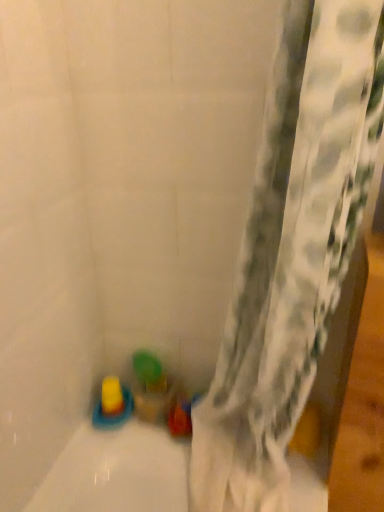
Question: Considering the relative sizes of translucent plastic cup at lower center, the third toy from the left, and yellow rubber toy at lower left, arranged as the first toy when viewed from the left, in the image provided, is translucent plastic cup at lower center, the third toy from the left, thinner than yellow rubber toy at lower left, arranged as the first toy when viewed from the left,?

Choices:
 (A) no
 (B) yes

Answer: (B)

Question: Is yellow rubber toy at lower left, arranged as the first toy when viewed from the left, inside translucent plastic cup at lower center, positioned as the first toy in right-to-left order?

Choices:
 (A) no
 (B) yes

Answer: (A)

Question: Can you confirm if translucent plastic cup at lower center, the third toy from the left, is bigger than yellow rubber toy at lower left, arranged as the first toy when viewed from the left?

Choices:
 (A) yes
 (B) no

Answer: (A)

Question: From a real-world perspective, is translucent plastic cup at lower center, the third toy from the left, on yellow rubber toy at lower left, marked as the 3th toy in a right-to-left arrangement?

Choices:
 (A) yes
 (B) no

Answer: (B)

Question: Does translucent plastic cup at lower center, positioned as the first toy in right-to-left order, turn towards yellow rubber toy at lower left, marked as the 3th toy in a right-to-left arrangement?

Choices:
 (A) yes
 (B) no

Answer: (B)

Question: Can you confirm if translucent plastic cup at lower center, the third toy from the left, is smaller than yellow rubber toy at lower left, arranged as the first toy when viewed from the left?

Choices:
 (A) no
 (B) yes

Answer: (A)

Question: Are translucent yellow toy at bottom left, the 2th toy when ordered from right to left, and yellow rubber toy at lower left, marked as the 3th toy in a right-to-left arrangement, located far from each other?

Choices:
 (A) yes
 (B) no

Answer: (B)

Question: From a real-world perspective, is translucent yellow toy at bottom left, which is counted as the second toy, starting from the left, beneath yellow rubber toy at lower left, marked as the 3th toy in a right-to-left arrangement?

Choices:
 (A) no
 (B) yes

Answer: (B)

Question: Is translucent yellow toy at bottom left, which is counted as the second toy, starting from the left, oriented away from yellow rubber toy at lower left, arranged as the first toy when viewed from the left?

Choices:
 (A) no
 (B) yes

Answer: (A)

Question: Is translucent yellow toy at bottom left, the 2th toy when ordered from right to left, outside yellow rubber toy at lower left, marked as the 3th toy in a right-to-left arrangement?

Choices:
 (A) yes
 (B) no

Answer: (A)

Question: Can you confirm if translucent yellow toy at bottom left, which is counted as the second toy, starting from the left, is positioned to the right of yellow rubber toy at lower left, marked as the 3th toy in a right-to-left arrangement?

Choices:
 (A) no
 (B) yes

Answer: (B)

Question: Considering the relative sizes of translucent yellow toy at bottom left, the 2th toy when ordered from right to left, and yellow rubber toy at lower left, arranged as the first toy when viewed from the left, in the image provided, is translucent yellow toy at bottom left, the 2th toy when ordered from right to left, shorter than yellow rubber toy at lower left, arranged as the first toy when viewed from the left,?

Choices:
 (A) no
 (B) yes

Answer: (B)

Question: Considering the relative positions of yellow rubber toy at lower left, arranged as the first toy when viewed from the left, and translucent plastic cup at lower center, the third toy from the left, in the image provided, is yellow rubber toy at lower left, arranged as the first toy when viewed from the left, to the left of translucent plastic cup at lower center, the third toy from the left, from the viewer's perspective?

Choices:
 (A) no
 (B) yes

Answer: (B)